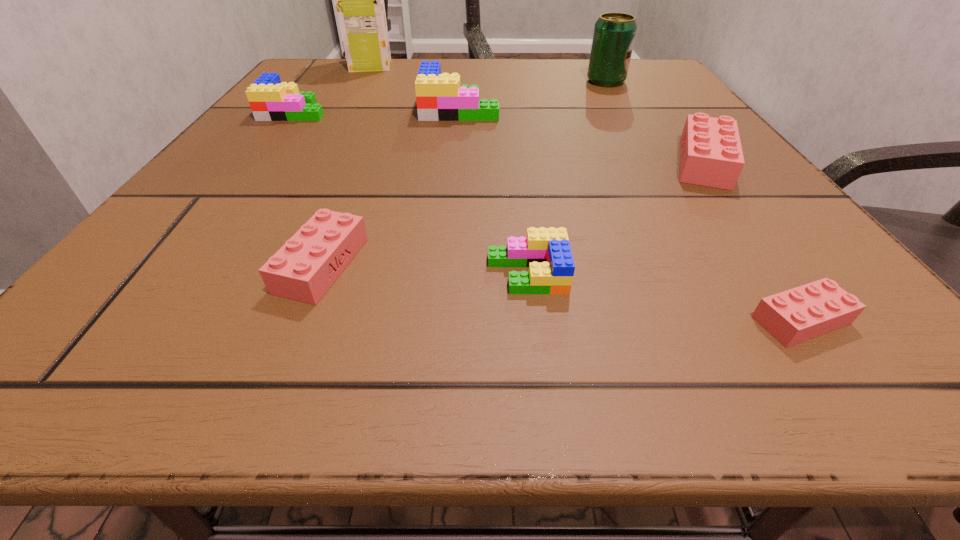
Identify the location of vacant space in between the shortest object and the beer can. This screenshot has height=540, width=960. (704, 201).

You are a GUI agent. You are given a task and a screenshot of the screen. Output one action in this format:
    pyautogui.click(x=<x>, y=<y>)
    Task: Click on the free space between the shortest object and the beer can
    The height and width of the screenshot is (540, 960).
    Given the screenshot: What is the action you would take?
    pyautogui.click(x=704, y=201)

You are a GUI agent. You are given a task and a screenshot of the screen. Output one action in this format:
    pyautogui.click(x=<x>, y=<y>)
    Task: Click on the vacant region between the leftmost Lego and the nearest green Lego
    
    Given the screenshot: What is the action you would take?
    pyautogui.click(x=411, y=192)

Identify the location of vacant space in between the second smallest green Lego and the farthest pink Lego. (499, 137).

Locate an element on the screen. The width and height of the screenshot is (960, 540). vacant space that's between the second tallest object and the third farthest Lego is located at coordinates (655, 122).

Choose which object is the fourth nearest neighbor to the shortest Lego. Please provide its 2D coordinates. Your answer should be formatted as a tuple, i.e. [(x, y)], where the tuple contains the x and y coordinates of a point satisfying the conditions above.

[(439, 97)]

Select which object appears as the fifth closest to the leftmost Lego. Please provide its 2D coordinates. Your answer should be formatted as a tuple, i.e. [(x, y)], where the tuple contains the x and y coordinates of a point satisfying the conditions above.

[(614, 34)]

I want to click on the third closest Lego to the biggest pink Lego, so click(x=439, y=97).

You are a GUI agent. You are given a task and a screenshot of the screen. Output one action in this format:
    pyautogui.click(x=<x>, y=<y>)
    Task: Click on the Lego that stands as the third closest to the leftmost green Lego
    
    Given the screenshot: What is the action you would take?
    pyautogui.click(x=546, y=251)

Identify the location of green Lego that can be found as the second closest to the smallest green Lego. This screenshot has width=960, height=540. (270, 100).